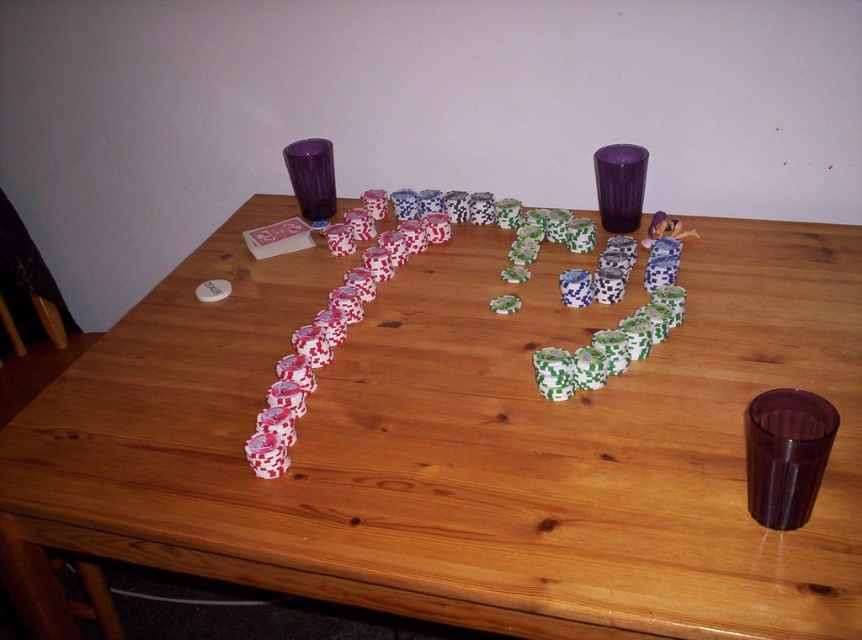
Does transparent plastic shot glass at lower right lie behind transparent purple shot glass at upper center?

No, transparent plastic shot glass at lower right is closer to the viewer.

Does transparent plastic shot glass at lower right appear under transparent purple shot glass at upper center?

Correct, transparent plastic shot glass at lower right is located below transparent purple shot glass at upper center.

Which is behind, point (811, 426) or point (595, 184)?

The point (595, 184) is more distant.

Locate an element on the screen. The width and height of the screenshot is (862, 640). transparent plastic shot glass at lower right is located at coordinates click(x=786, y=454).

Is wooden table at center behind transparent plastic shot glass at lower right?

No.

Which of these two, wooden table at center or transparent plastic shot glass at lower right, stands taller?

With more height is wooden table at center.

I want to click on wooden table at center, so click(458, 445).

I want to click on wooden table at center, so click(458, 445).

Is wooden table at center above transparent purple shot glass at upper center?

No.

Which is behind, point (497, 291) or point (635, 189)?

The point (635, 189) is more distant.

This screenshot has width=862, height=640. In order to click on wooden table at center in this screenshot , I will do `click(458, 445)`.

The image size is (862, 640). I want to click on wooden table at center, so click(x=458, y=445).